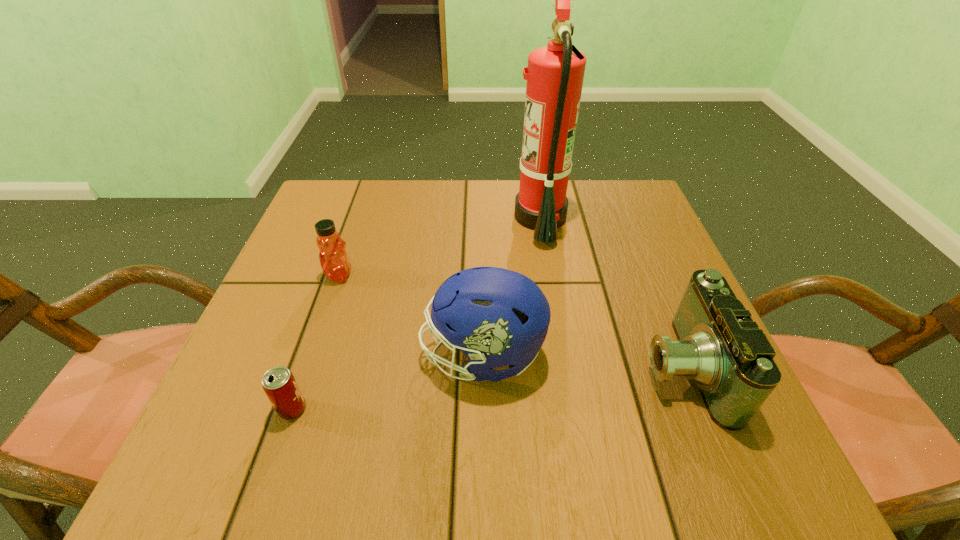
Locate an element on the screen. vacant space at the near right corner of the desktop is located at coordinates (683, 465).

Where is `free point between the second tallest object and the fourth nearest object`? This screenshot has width=960, height=540. free point between the second tallest object and the fourth nearest object is located at coordinates (411, 315).

The width and height of the screenshot is (960, 540). Identify the location of vacant space that's between the second tallest object and the shortest object. (388, 382).

This screenshot has width=960, height=540. Identify the location of free spot between the rightmost object and the beer can. (487, 388).

Where is `free area in between the shortest object and the honey`? The width and height of the screenshot is (960, 540). free area in between the shortest object and the honey is located at coordinates (316, 342).

Identify the location of free space between the camcorder and the shortest object. Image resolution: width=960 pixels, height=540 pixels. (487, 388).

Find the location of a particular element. free spot between the rightmost object and the fourth shortest object is located at coordinates (582, 361).

Where is `free space between the second tallest object and the camcorder`? This screenshot has width=960, height=540. free space between the second tallest object and the camcorder is located at coordinates tap(582, 361).

Where is `object that stands as the fourth closest to the fire extinguisher`? This screenshot has height=540, width=960. object that stands as the fourth closest to the fire extinguisher is located at coordinates (279, 384).

Select which object appears as the fourth closest to the fourth shortest object. Please provide its 2D coordinates. Your answer should be formatted as a tuple, i.e. [(x, y)], where the tuple contains the x and y coordinates of a point satisfying the conditions above.

[(555, 73)]